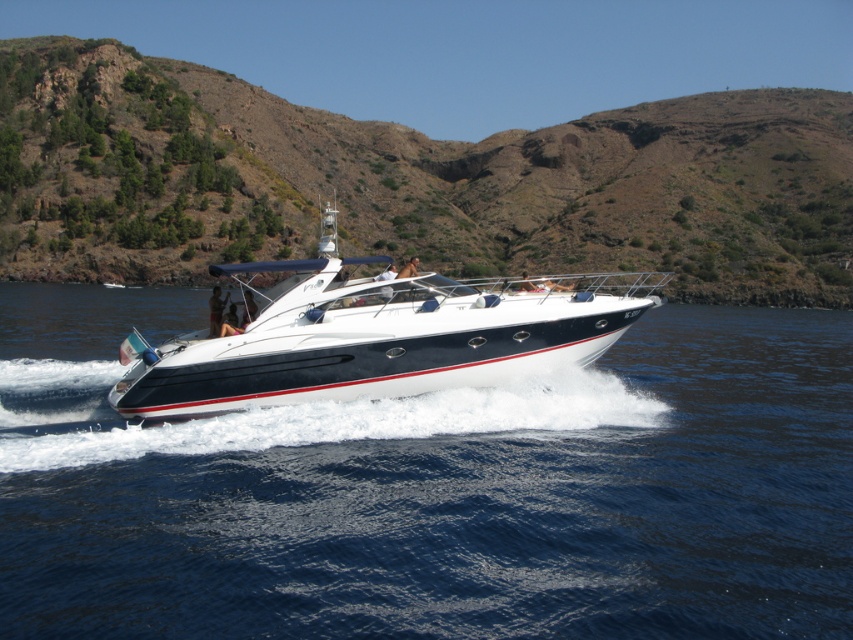
You are a photographer on the white glossy boat at center. You want to capture the blue liquid water at center in your shot. Considering their sizes, which one should you focus on to ensure both are visible in the frame?

The blue liquid water at center has a smaller size compared to the white glossy boat at center, so you should focus on the white glossy boat at center to ensure both fit into the frame since it is larger and can accommodate the smaller water area within the same shot.

You are a passenger on the white glossy boat at center. You want to pour a drink into a glass placed on the blue liquid water at center. Is the glass located to the left or right side of the boat?

The blue liquid water at center is positioned on the right side of white glossy boat at center, so the glass is on the right side of the boat.